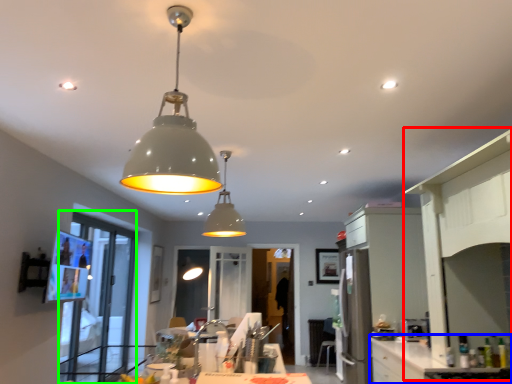
Question: Based on their relative distances, which object is nearer to side (highlighted by a red box)? Choose from counter top (highlighted by a blue box) and glass door (highlighted by a green box).

Choices:
 (A) counter top
 (B) glass door

Answer: (A)